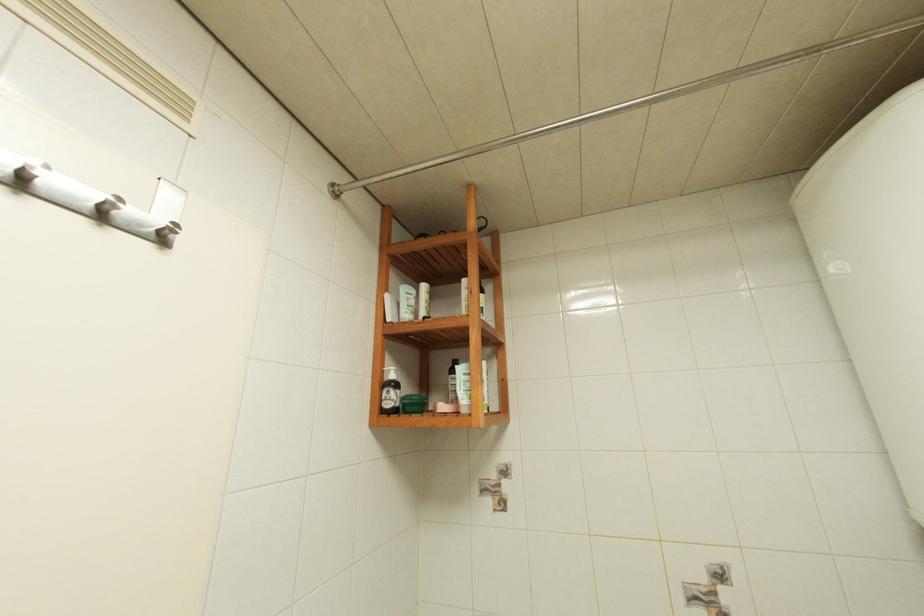
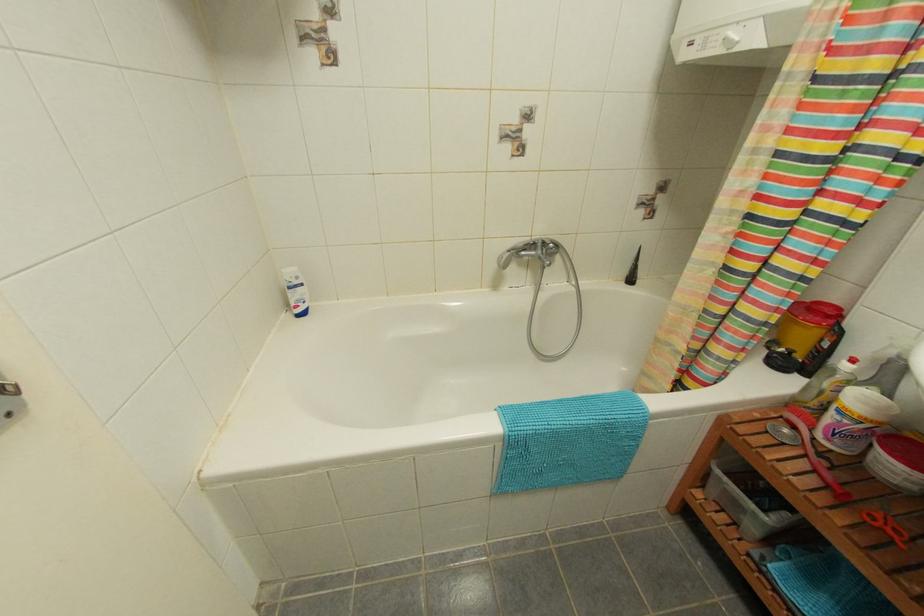
The first image is from the beginning of the video and the second image is from the end. How did the camera likely rotate when shooting the video?

The camera rotated toward right-down.